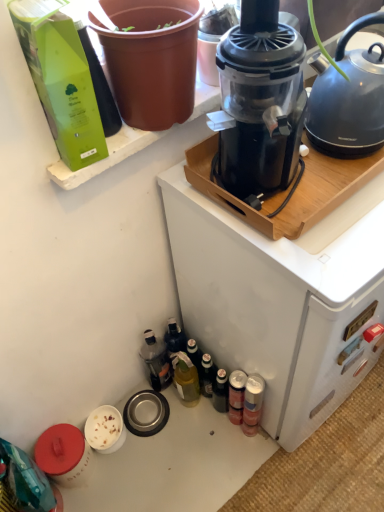
The width and height of the screenshot is (384, 512). What are the coordinates of `vacant space that is to the left of metallic silver can at lower right, which ranks as the third bottle in left-to-right order` in the screenshot? It's located at (195, 435).